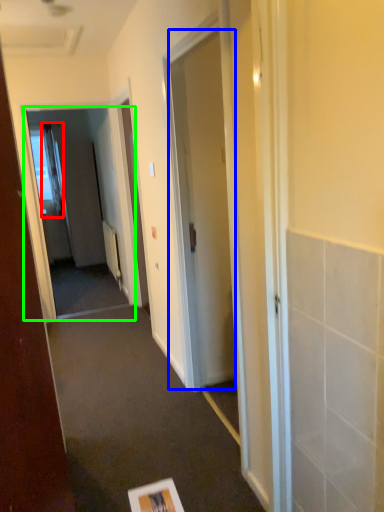
Question: Based on their relative distances, which object is nearer to curtain (highlighted by a red box)? Choose from door (highlighted by a blue box) and screen door (highlighted by a green box).

Choices:
 (A) door
 (B) screen door

Answer: (B)